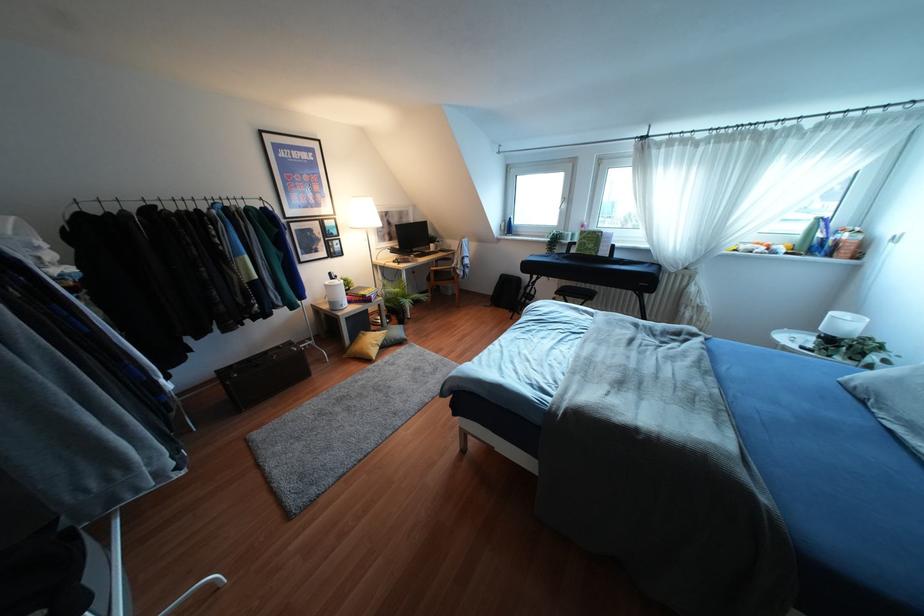
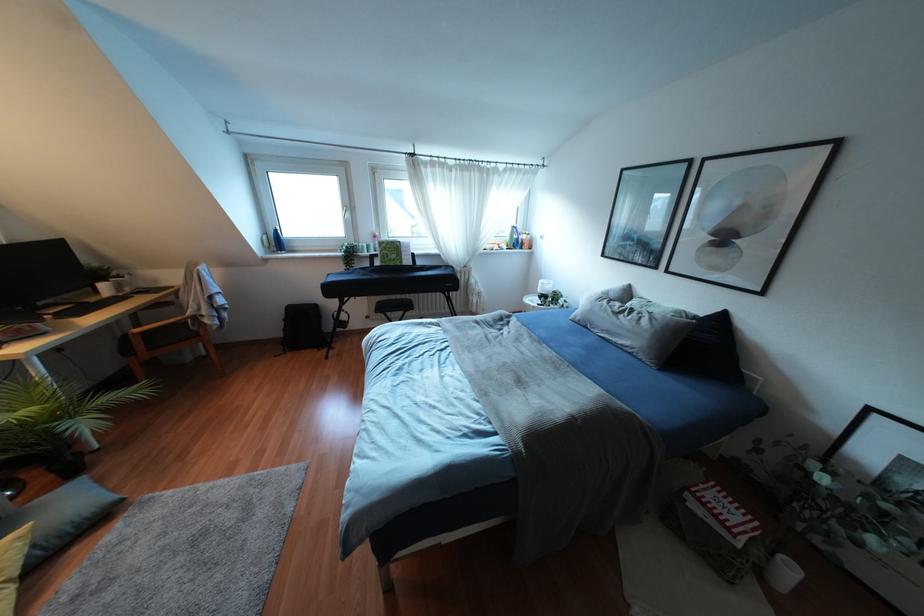
Question: The camera is either moving clockwise (left) or counter-clockwise (right) around the object. The first image is from the beginning of the video and the second image is from the end. Is the camera moving left or right when shooting the video?

Choices:
 (A) Left
 (B) Right

Answer: (A)